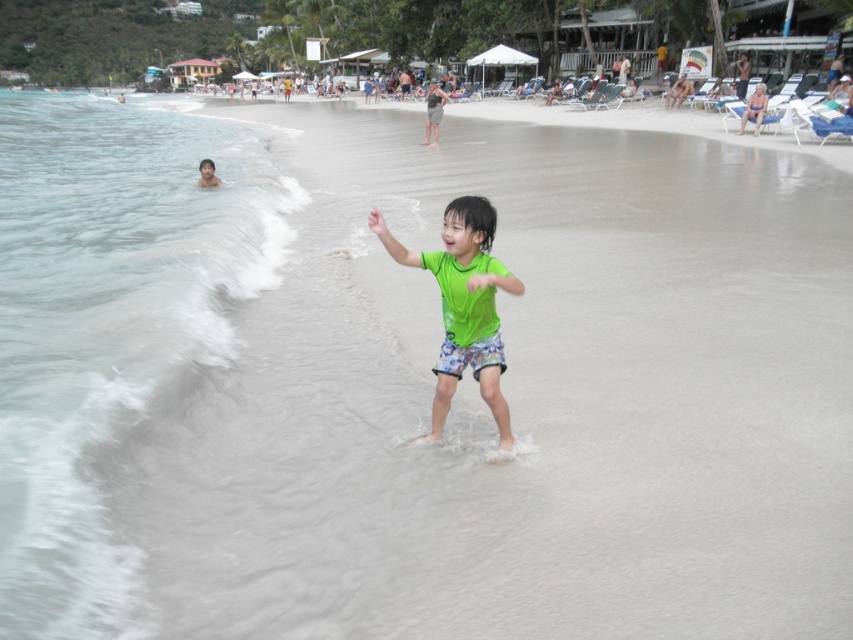
You are a photographer trying to capture the clear water at left in your shot. Based on its 2D location coordinates, where should you position your camera to ensure it is centered in the frame?

To center the clear water at left in your frame, position your camera so that it aligns with the coordinates point (109, 324), which is the 2D location of the clear water at left.